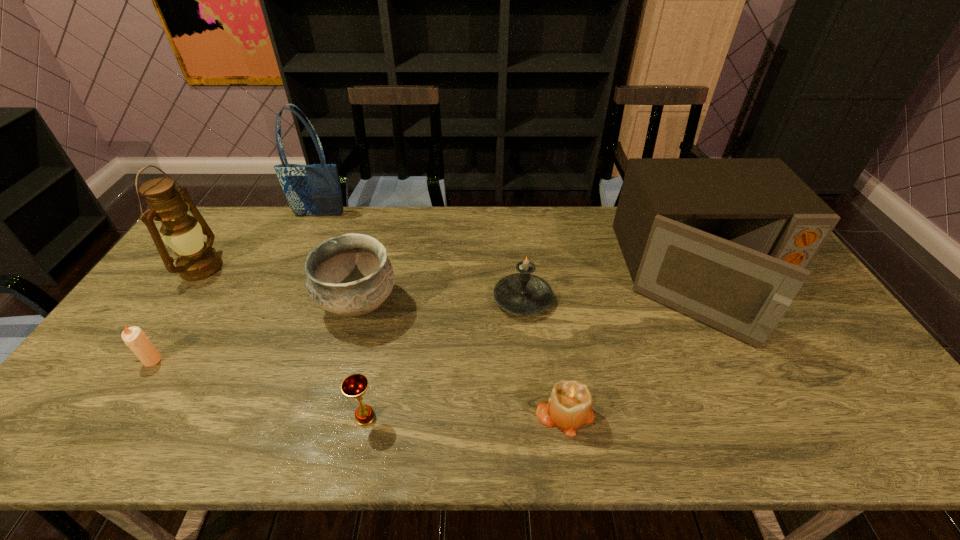
The height and width of the screenshot is (540, 960). Identify the location of free spot between the oil lamp and the nearest candle. (383, 340).

The height and width of the screenshot is (540, 960). Identify the location of vacant area that lies between the chalice and the shopping bag. (343, 316).

I want to click on vacant area between the nearest candle and the third object from left to right, so tap(442, 314).

Where is `vacant area that lies between the chalice and the rightmost object`? The width and height of the screenshot is (960, 540). vacant area that lies between the chalice and the rightmost object is located at coordinates (536, 349).

Where is `vacant space in between the oil lamp and the chalice`? The image size is (960, 540). vacant space in between the oil lamp and the chalice is located at coordinates (283, 342).

Find the location of a particular element. The height and width of the screenshot is (540, 960). free spot between the tallest candle and the third object from left to right is located at coordinates (421, 257).

I want to click on free area in between the tallest candle and the nearest candle, so click(x=543, y=356).

This screenshot has height=540, width=960. Identify the location of vacant area that lies between the tallest candle and the leftmost candle. (338, 329).

The height and width of the screenshot is (540, 960). What are the coordinates of `free space between the chalice and the oil lamp` in the screenshot? It's located at (283, 342).

Choose which object is the sixth nearest neighbor to the rightmost object. Please provide its 2D coordinates. Your answer should be formatted as a tuple, i.e. [(x, y)], where the tuple contains the x and y coordinates of a point satisfying the conditions above.

[(134, 337)]